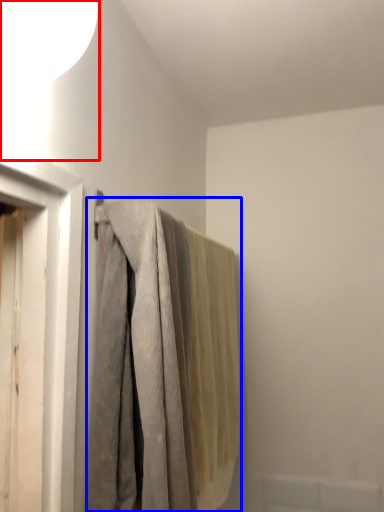
Question: Which of the following is the farthest to the observer, lamp (highlighted by a red box) or curtain (highlighted by a blue box)?

Choices:
 (A) lamp
 (B) curtain

Answer: (B)